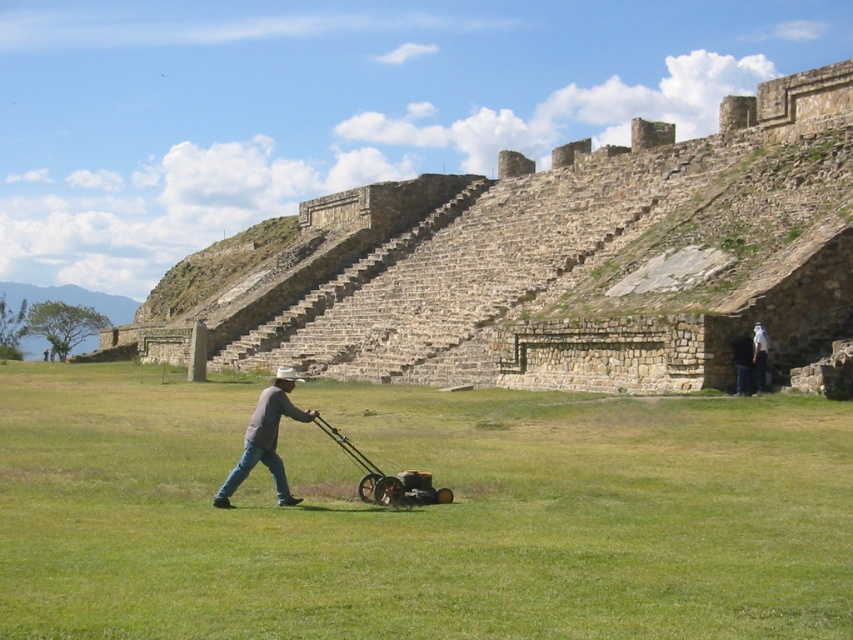
You are standing in the open grassy area near the ancient stone structure and see both the gray cotton shirt at center and the white cotton shirt at center. Which shirt is nearer to you?

The gray cotton shirt at center is closer to the viewer than the white cotton shirt at center.

You are a drone operator who needs to deliver a small package to both the gray cotton shirt at center and the white cotton shirt at center. What is the minimum distance you need to fly the drone to ensure it reaches both shirts?

The minimum distance the drone needs to fly to reach both the gray cotton shirt at center and the white cotton shirt at center is 18.81 meters, as that is the distance between them.

You are standing at the base of the stone amphitheater at center and want to move to the yellow metallic mower at center. Which direction should you go to reach it?

The yellow metallic mower at center is below the stone amphitheater at center, so you should go downward to reach it.